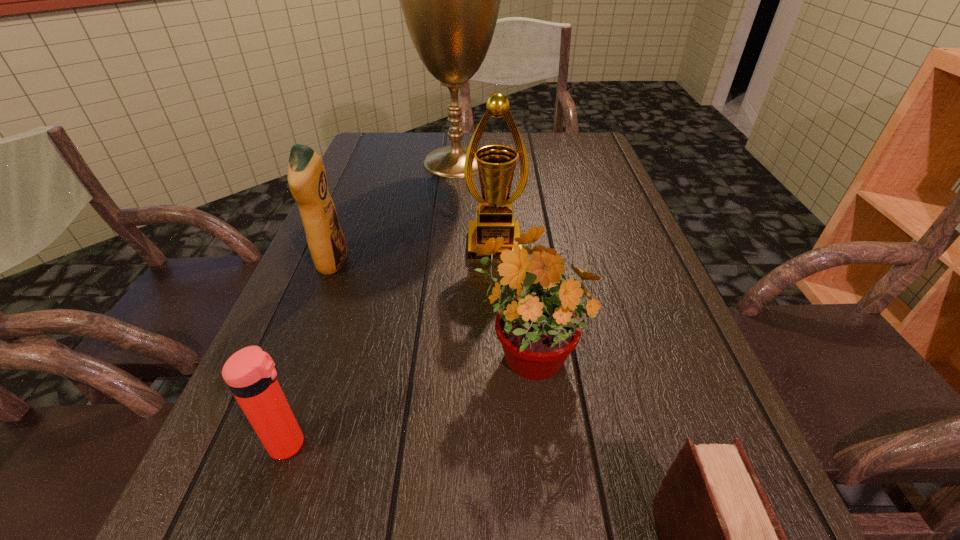
Find the location of a particular element. The height and width of the screenshot is (540, 960). vacant space located 0.140m on the front of the flowerpot is located at coordinates (541, 480).

Where is `blank space located on the right of the thermos bottle`? The image size is (960, 540). blank space located on the right of the thermos bottle is located at coordinates (489, 444).

Where is `object at the far edge`? object at the far edge is located at coordinates (450, 0).

Identify the location of detergent located at the left edge. (307, 180).

This screenshot has width=960, height=540. Identify the location of thermos bottle that is at the left edge. (250, 373).

Where is `vacant space at the left edge of the desktop`? vacant space at the left edge of the desktop is located at coordinates (304, 418).

Where is `vacant region at the right edge of the desktop`? This screenshot has height=540, width=960. vacant region at the right edge of the desktop is located at coordinates (589, 286).

Where is `empty space that is in between the detergent and the second tallest object`? empty space that is in between the detergent and the second tallest object is located at coordinates (413, 254).

Identify the location of unoccupied area between the award and the detergent. Image resolution: width=960 pixels, height=540 pixels. (413, 254).

You are a GUI agent. You are given a task and a screenshot of the screen. Output one action in this format:
    pyautogui.click(x=<x>, y=<y>)
    Task: Click on the free space that is in between the award and the detergent
    The image size is (960, 540).
    Given the screenshot: What is the action you would take?
    pyautogui.click(x=413, y=254)